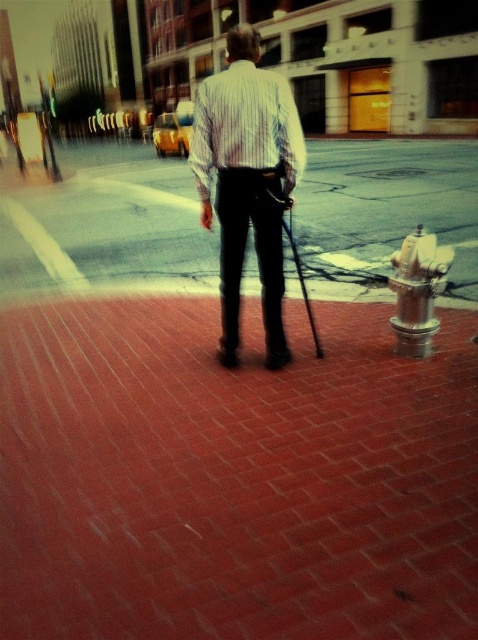
Question: Estimate the real-world distances between objects in this image. Which object is farther from the brick pavement at center?

Choices:
 (A) white striped shirt at center
 (B) striped cotton shirt at center

Answer: (A)

Question: Which is farther from the brick pavement at center?

Choices:
 (A) striped cotton shirt at center
 (B) brick at center
 (C) white striped shirt at center

Answer: (C)

Question: Among these points, which one is farthest from the camera?

Choices:
 (A) (248, 300)
 (B) (201, 122)
 (C) (147, 188)
 (D) (280, 336)

Answer: (C)

Question: Can you confirm if brick at center is positioned to the left of striped cotton shirt at center?

Choices:
 (A) no
 (B) yes

Answer: (A)

Question: Can you confirm if brick at center is positioned to the left of white striped shirt at center?

Choices:
 (A) yes
 (B) no

Answer: (B)

Question: Is brick pavement at center to the left of striped cotton shirt at center from the viewer's perspective?

Choices:
 (A) no
 (B) yes

Answer: (B)